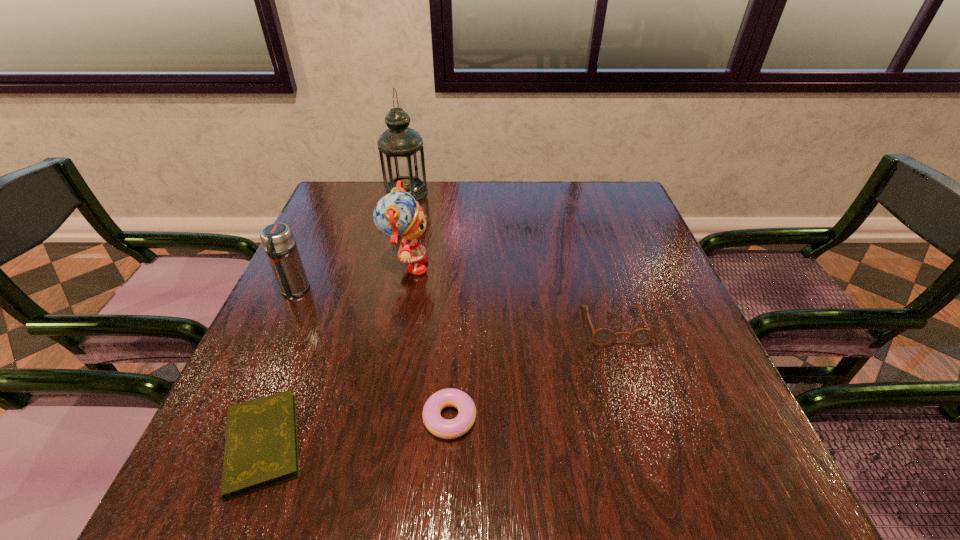
The width and height of the screenshot is (960, 540). Find the location of `object present at the near left corner`. object present at the near left corner is located at coordinates (261, 444).

Where is `vacant space at the far edge of the desktop`? vacant space at the far edge of the desktop is located at coordinates (566, 204).

Locate an element on the screen. This screenshot has height=540, width=960. vacant space at the near edge of the desktop is located at coordinates (588, 494).

Locate an element on the screen. The image size is (960, 540). blank space at the left edge is located at coordinates (284, 336).

Identify the location of free location at the right edge. (692, 426).

Where is `vacant space at the far left corner of the desktop`? vacant space at the far left corner of the desktop is located at coordinates (369, 213).

This screenshot has height=540, width=960. Find the location of `vacant space at the far right corner of the desktop`. vacant space at the far right corner of the desktop is located at coordinates (608, 211).

Find the location of a particular element. The height and width of the screenshot is (540, 960). free space that is in between the thermos bottle and the diary is located at coordinates (278, 367).

Locate an element on the screen. vacant area between the rightmost object and the doll is located at coordinates (510, 297).

Identify the location of free spot between the doughnut and the tallest object. (428, 305).